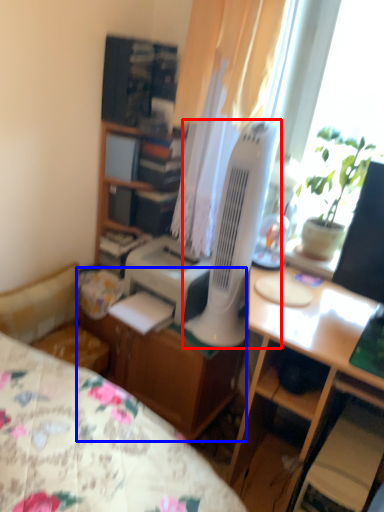
Question: Among these objects, which one is nearest to the camera, mechanical fan (highlighted by a red box) or file cabinet (highlighted by a blue box)?

Choices:
 (A) mechanical fan
 (B) file cabinet

Answer: (A)